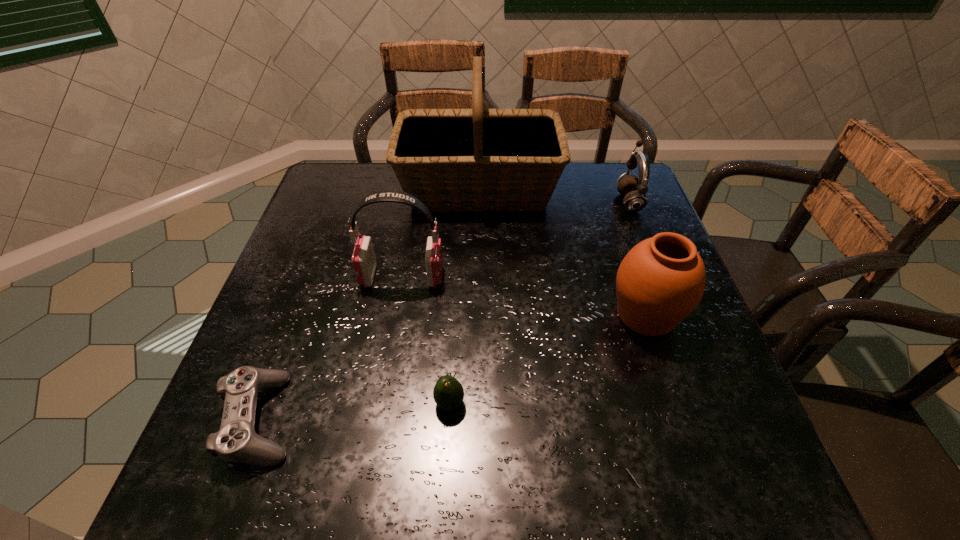
Identify the location of free space between the fourth shortest object and the tallest object. (563, 252).

This screenshot has height=540, width=960. I want to click on free space between the avocado and the leftmost object, so click(x=355, y=411).

Locate an element on the screen. The height and width of the screenshot is (540, 960). vacant area that lies between the right earphone and the basket is located at coordinates (554, 195).

Locate an element on the screen. This screenshot has width=960, height=540. blank region between the basket and the shorter earphone is located at coordinates (554, 195).

Where is `vacant region between the avocado and the basket`? This screenshot has width=960, height=540. vacant region between the avocado and the basket is located at coordinates (465, 296).

At what (x,y) coordinates should I click in order to perform the action: click on free space between the control and the basket. Please return your answer as a coordinate pair (x, y). This screenshot has height=540, width=960. Looking at the image, I should click on (370, 303).

I want to click on free spot between the left earphone and the basket, so click(441, 233).

Where is `free space between the basket and the avocado`? The width and height of the screenshot is (960, 540). free space between the basket and the avocado is located at coordinates (465, 296).

Locate an element on the screen. The height and width of the screenshot is (540, 960). free spot between the basket and the urn is located at coordinates (563, 252).

I want to click on object that can be found as the second closest to the avocado, so pos(364,262).